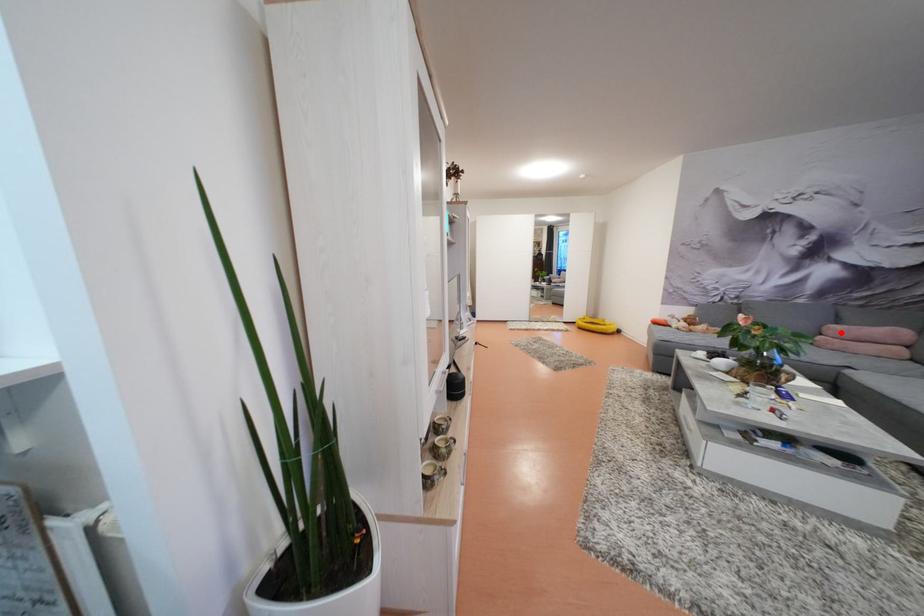
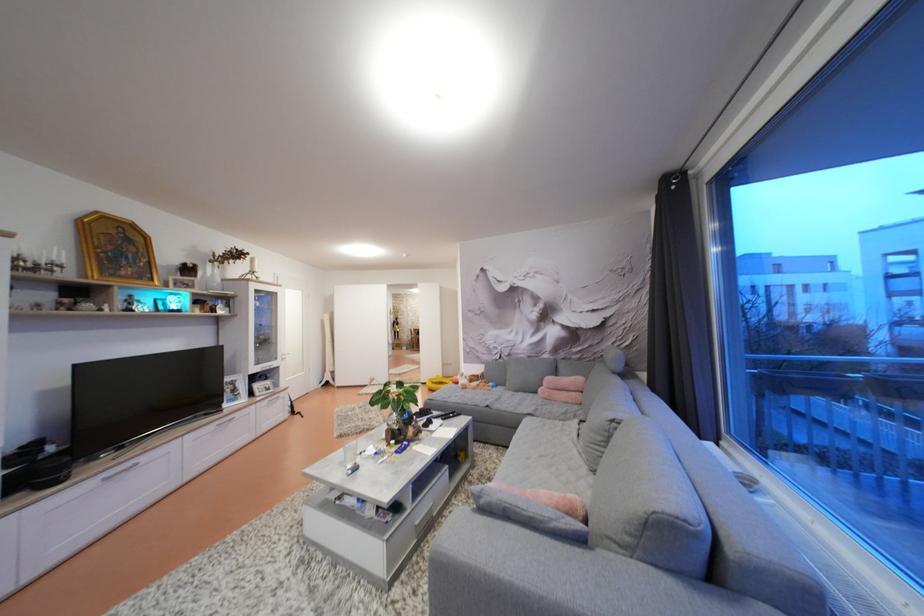
Locate, in the second image, the point that corresponds to the highlighted location in the first image.

(556, 384)